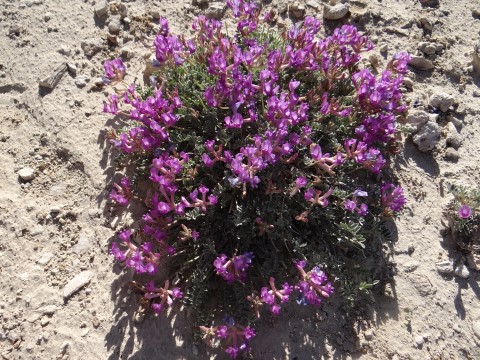
You are a GUI agent. You are given a task and a screenshot of the screen. Output one action in this format:
    pyautogui.click(x=<x>, y=<y>)
    Task: Click on the wilting flowers
    
    Given the screenshot: What is the action you would take?
    pyautogui.click(x=300, y=218)